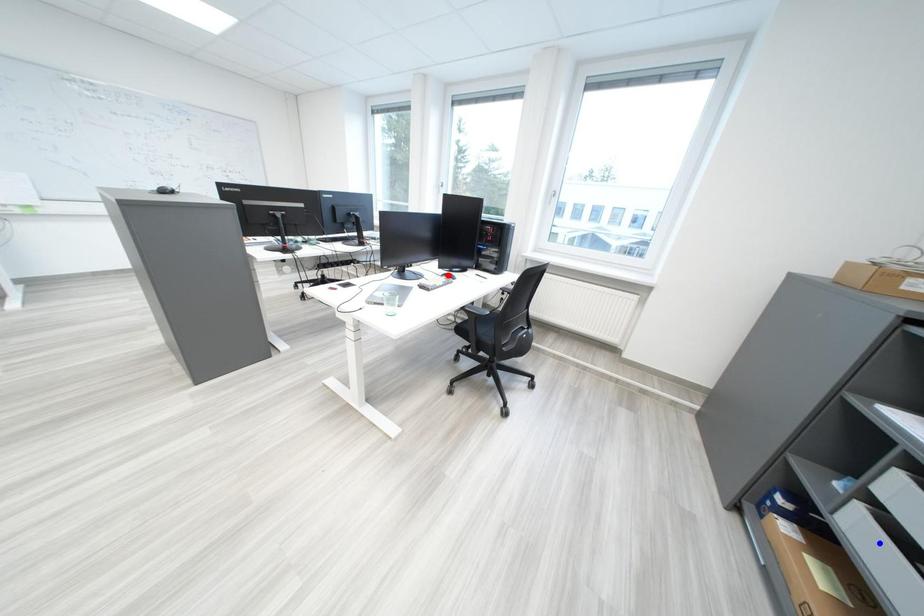
Question: Which of the two points in the image is closer to the camera?

Choices:
 (A) Blue point is closer.
 (B) Red point is closer.

Answer: (A)